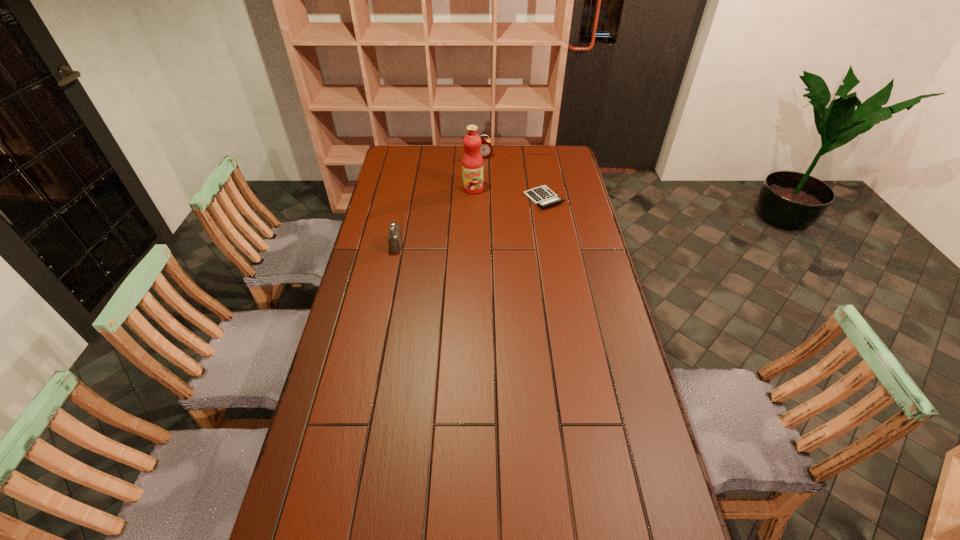
Find the location of a particular element. Image resolution: width=960 pixels, height=540 pixels. padlock is located at coordinates (395, 239).

Where is `the nearest object`? the nearest object is located at coordinates (395, 239).

You are a GUI agent. You are given a task and a screenshot of the screen. Output one action in this format:
    pyautogui.click(x=<x>, y=<y>)
    Task: Click on the calculator
    The height and width of the screenshot is (540, 960).
    Given the screenshot: What is the action you would take?
    pyautogui.click(x=542, y=196)

Where is `the shortest object`? the shortest object is located at coordinates (542, 196).

Where is `the farthest object`? This screenshot has height=540, width=960. the farthest object is located at coordinates (486, 149).

Identify the location of the tallest object. Image resolution: width=960 pixels, height=540 pixels. (472, 162).

Where is `free space located 0.060m at the front of the padlock near the keyhole`? This screenshot has width=960, height=540. free space located 0.060m at the front of the padlock near the keyhole is located at coordinates (375, 246).

Locate an element on the screen. This screenshot has width=960, height=540. vacant point located 0.110m at the front of the padlock near the keyhole is located at coordinates (362, 246).

Locate an element on the screen. The width and height of the screenshot is (960, 540). blank space located 0.100m at the front of the padlock near the keyhole is located at coordinates (365, 246).

Find the location of a particular element. blank space located on the back of the calculator is located at coordinates (536, 150).